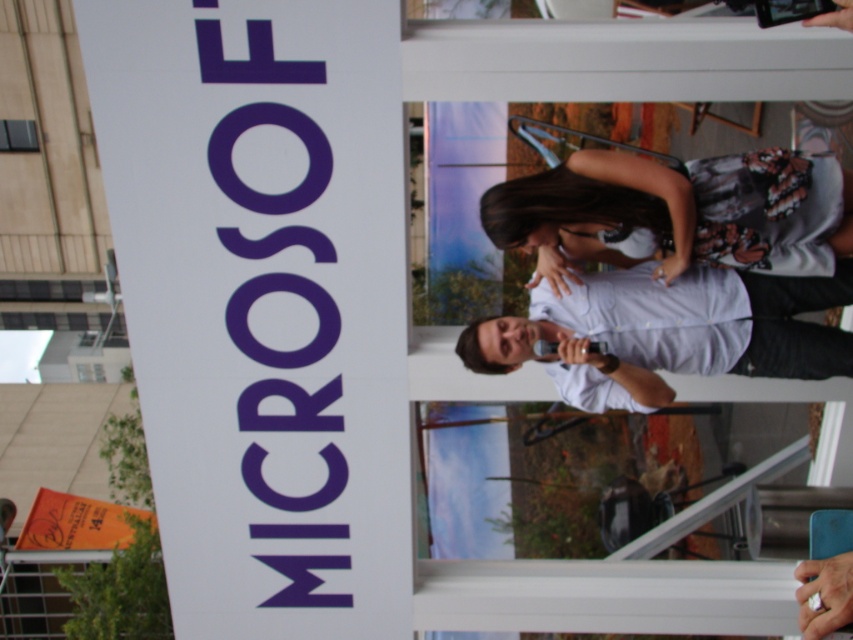
Can you confirm if white paper sign at upper left is positioned to the right of white matte shirt at center?

No, white paper sign at upper left is not to the right of white matte shirt at center.

Does white paper sign at upper left have a greater height compared to white matte shirt at center?

Yes.

Who is more forward, (361,109) or (701,355)?

Positioned in front is point (361,109).

This screenshot has height=640, width=853. Identify the location of white paper sign at upper left. (263, 301).

Does white paper sign at upper left come in front of floral-patterned fabric at center?

Yes, it is.

In the scene shown: Between white paper sign at upper left and floral-patterned fabric at center, which one has less height?

Standing shorter between the two is floral-patterned fabric at center.

Between point (227, 168) and point (734, 208), which one is positioned in front?

Point (734, 208) is more forward.

The image size is (853, 640). I want to click on white paper sign at upper left, so click(263, 301).

Does floral-patterned fabric at center appear on the right side of white matte shirt at center?

Indeed, floral-patterned fabric at center is positioned on the right side of white matte shirt at center.

Can you confirm if floral-patterned fabric at center is positioned above white matte shirt at center?

Indeed, floral-patterned fabric at center is positioned over white matte shirt at center.

What do you see at coordinates (677, 212) in the screenshot? I see `floral-patterned fabric at center` at bounding box center [677, 212].

Locate an element on the screen. This screenshot has width=853, height=640. floral-patterned fabric at center is located at coordinates (677, 212).